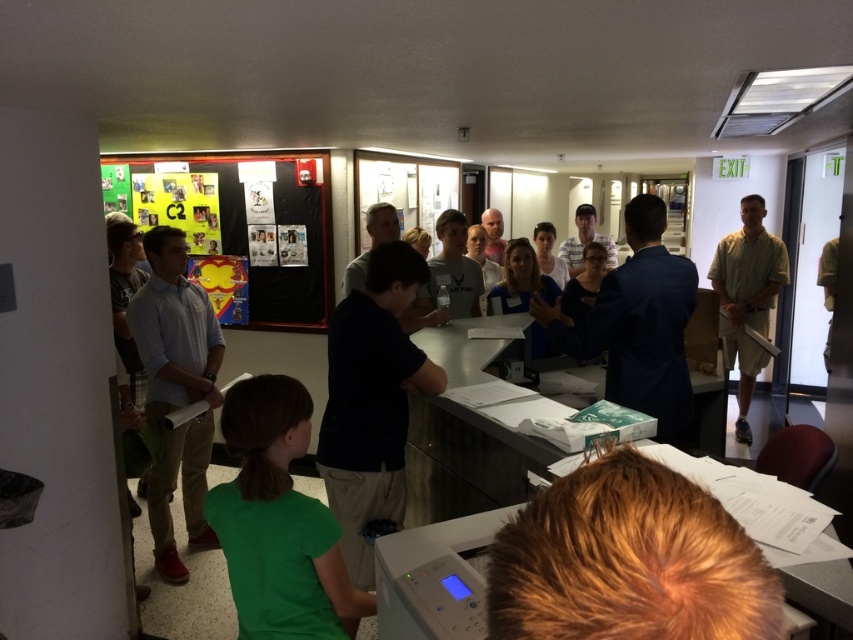
Question: Is green matte shirt at lower left above light blue shirt at left?

Choices:
 (A) no
 (B) yes

Answer: (A)

Question: Is light blue shirt at left thinner than multicolored paperboard at upper left?

Choices:
 (A) no
 (B) yes

Answer: (B)

Question: Which of the following is the closest to the observer?

Choices:
 (A) [x=727, y=330]
 (B) [x=328, y=154]
 (C) [x=155, y=324]

Answer: (C)

Question: Which of these objects is positioned closest to the multicolored paperboard at upper left?

Choices:
 (A) green textured shirt at right
 (B) green matte shirt at lower left

Answer: (B)

Question: Can you confirm if multicolored paperboard at upper left is smaller than green textured shirt at right?

Choices:
 (A) no
 (B) yes

Answer: (B)

Question: Which of these objects is positioned farthest from the light blue shirt at left?

Choices:
 (A) green matte shirt at lower left
 (B) multicolored paperboard at upper left

Answer: (A)